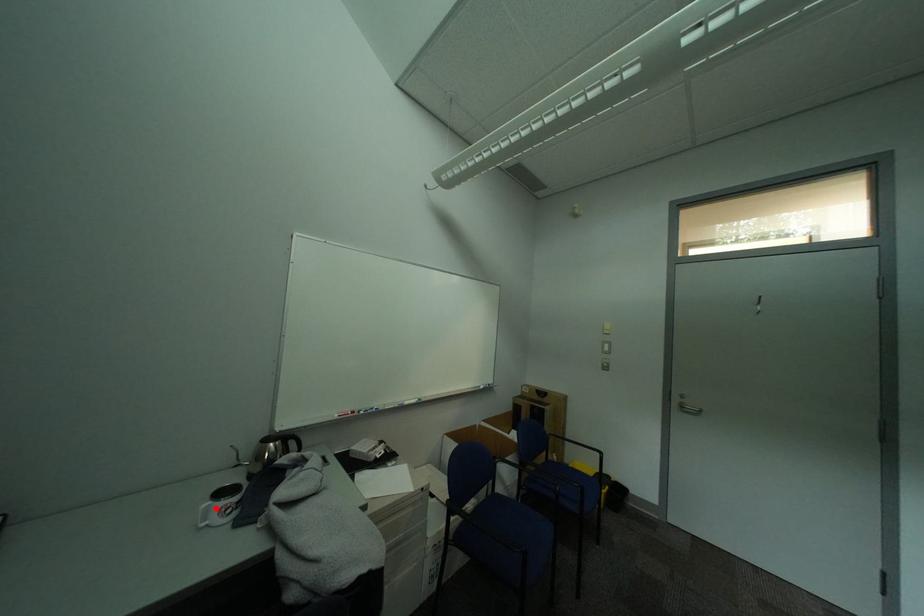
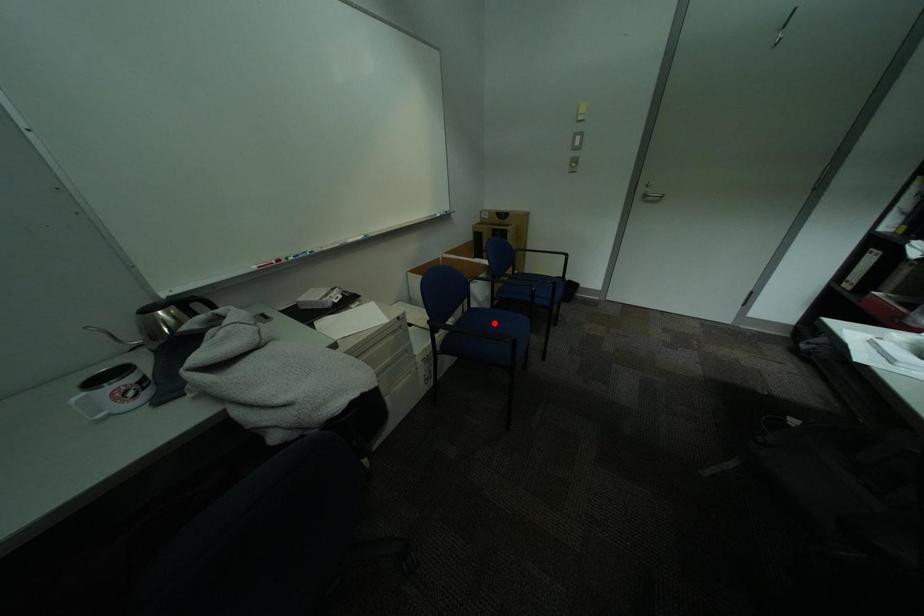
I am providing you with two images of the same scene from different viewpoints. A red point is marked on the first image and another point is marked on the second image. Is the red point in image1 aligned with the point shown in image2?

No